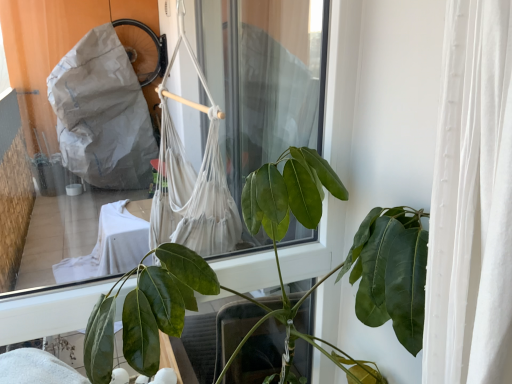
What are the coordinates of `green glossy leafy plant at center` in the screenshot? It's located at (379, 279).

Image resolution: width=512 pixels, height=384 pixels. Describe the element at coordinates (379, 279) in the screenshot. I see `green glossy leafy plant at center` at that location.

You are a GUI agent. You are given a task and a screenshot of the screen. Output one action in this format:
    pyautogui.click(x=<x>, y=<y>)
    Task: Click on the green glossy leafy plant at center
    The image size is (512, 384).
    Given the screenshot: What is the action you would take?
    pyautogui.click(x=379, y=279)